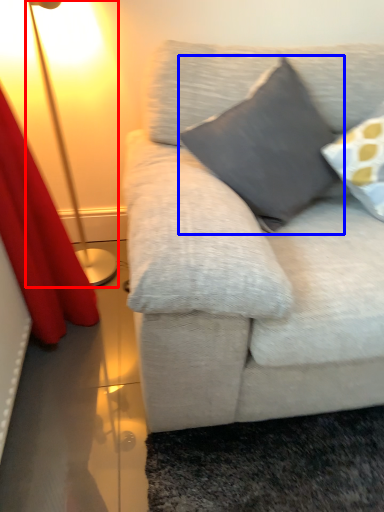
Question: Which point is further to the camera, lamp (highlighted by a red box) or pillow (highlighted by a blue box)?

Choices:
 (A) lamp
 (B) pillow

Answer: (A)